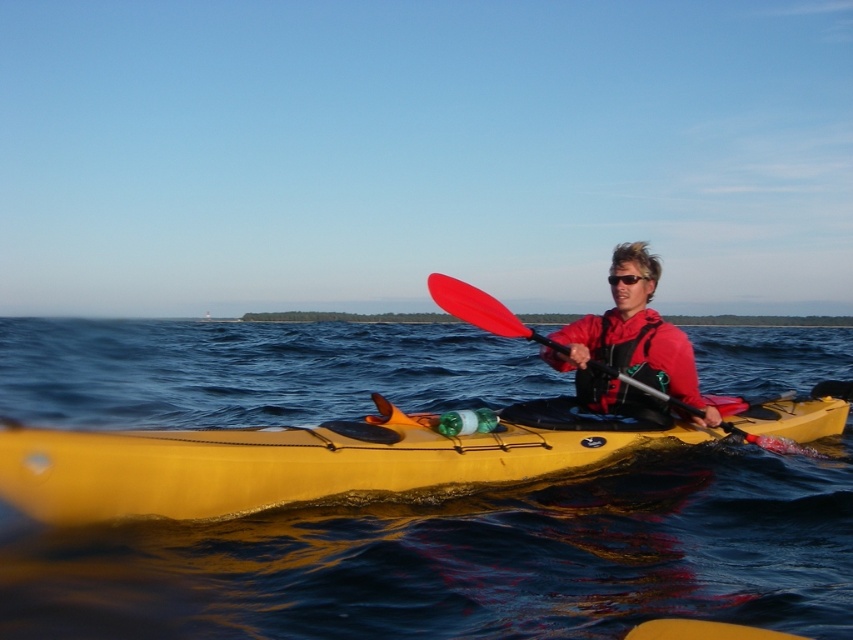
You are a safety inspector assessing the safety of the kayaker. According to the safety guidelines, the distance between the water and the life jacket must be less than 10 meters to ensure quick access. Can the kayaker reach the red fleece life jacket at center from the blue water at center within the required distance?

The blue water at center and red fleece life jacket at center are 9.73 meters apart from each other, which is under the 10 meter requirement. Therefore, the kayaker can reach the red fleece life jacket at center quickly.

You are a photographer trying to capture the kayaker and their gear. You notice the yellow matte kayak at center and the black plastic sunglasses at center. Which object should you zoom in on to get a clearer picture without moving your camera position?

The yellow matte kayak at center is bigger than the black plastic sunglasses at center, so you should zoom in on the yellow matte kayak at center to get a clearer picture without moving your camera position.

You are standing on the shore of the lake and see two points marked on the water in the image. Which point is closer to you, point (398, 477) or point (610, 276)?

Point (398, 477) is closer to the viewer than point (610, 276).